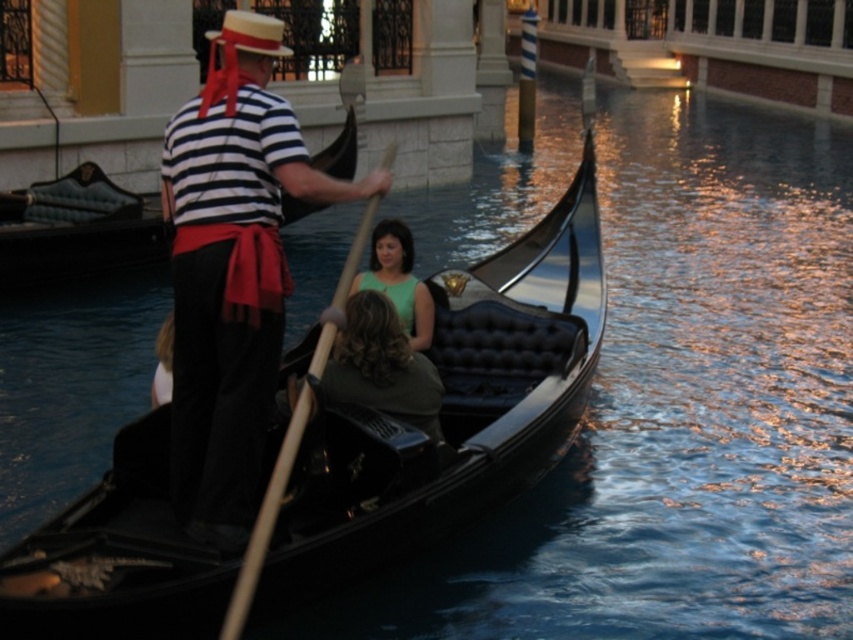
Who is taller, matte black gondolier at center or green matte dress at center?

matte black gondolier at center

Is matte black gondolier at center positioned behind green matte dress at center?

No.

Locate an element on the screen. matte black gondolier at center is located at coordinates (231, 272).

In order to click on matte black gondolier at center in this screenshot , I will do `click(231, 272)`.

Is black polished wood boat at center wider than green matte dress at center?

Yes, black polished wood boat at center is wider than green matte dress at center.

Does black polished wood boat at center lie behind green matte dress at center?

No, it is in front of green matte dress at center.

Locate an element on the screen. This screenshot has width=853, height=640. black polished wood boat at center is located at coordinates (454, 408).

I want to click on black polished wood boat at center, so click(454, 408).

Between point (544, 435) and point (177, 314), which one is positioned in front?

Point (177, 314)

Is point (444, 330) closer to camera compared to point (238, 301)?

That is False.

At what (x,y) coordinates should I click in order to perform the action: click on black polished wood boat at center. Please return your answer as a coordinate pair (x, y). Looking at the image, I should click on (454, 408).